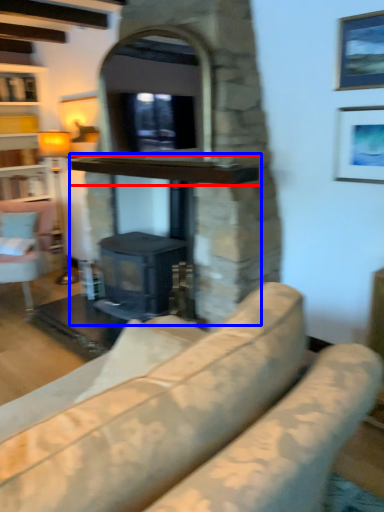
Question: Which object is further to the camera taking this photo, mantle (highlighted by a red box) or fireplace (highlighted by a blue box)?

Choices:
 (A) mantle
 (B) fireplace

Answer: (B)